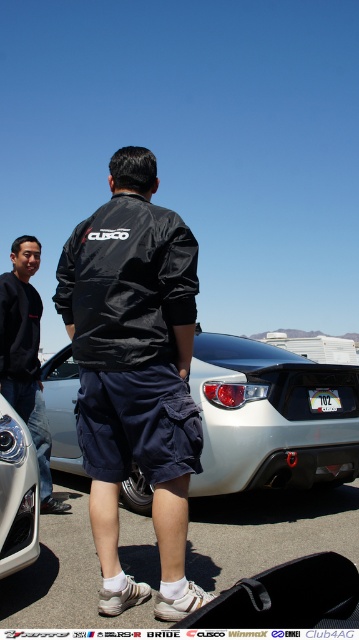
Who is more distant from viewer, (109, 556) or (234, 380)?

The point (234, 380) is more distant.

Does black leather jacket at center appear on the left side of white matte car at center?

Yes, black leather jacket at center is to the left of white matte car at center.

Who is more distant from viewer, (198,595) or (259,480)?

Positioned behind is point (259,480).

The image size is (359, 640). In order to click on black leather jacket at center in this screenshot , I will do `click(134, 372)`.

Is black leather jacket at center below white plastic license plate at rear?

Incorrect, black leather jacket at center is not positioned below white plastic license plate at rear.

Measure the distance from black leather jacket at center to white plastic license plate at rear.

They are 2.05 meters apart.

This screenshot has height=640, width=359. What are the coordinates of `black leather jacket at center` in the screenshot? It's located at (134, 372).

Does point (25, 314) lie behind point (34, 522)?

That is True.

Is black matte jacket at left closer to the viewer compared to matte silver headlight at lower left?

No, it is not.

Who is more forward, (x=33, y=376) or (x=21, y=554)?

Point (x=21, y=554) is more forward.

The image size is (359, 640). Identify the location of black matte jacket at left. (25, 356).